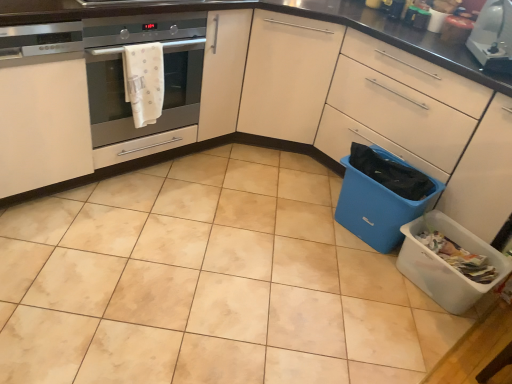
Where is `free spot below matte white cabinet at center, the 1th cabinetry viewed from the right (from a real-world perspective)`? Image resolution: width=512 pixels, height=384 pixels. free spot below matte white cabinet at center, the 1th cabinetry viewed from the right (from a real-world perspective) is located at coordinates (227, 268).